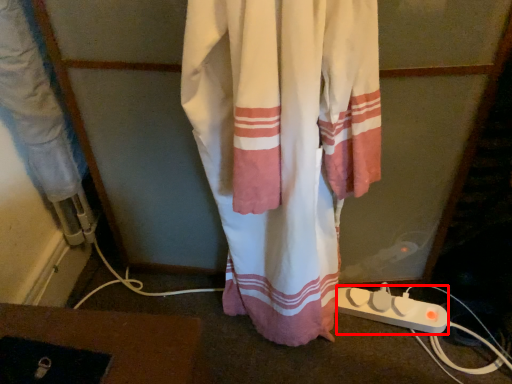
Question: From the image's perspective, what is the correct spatial positioning of extension cord (annotated by the red box) in reference to curtain?

Choices:
 (A) below
 (B) above

Answer: (A)